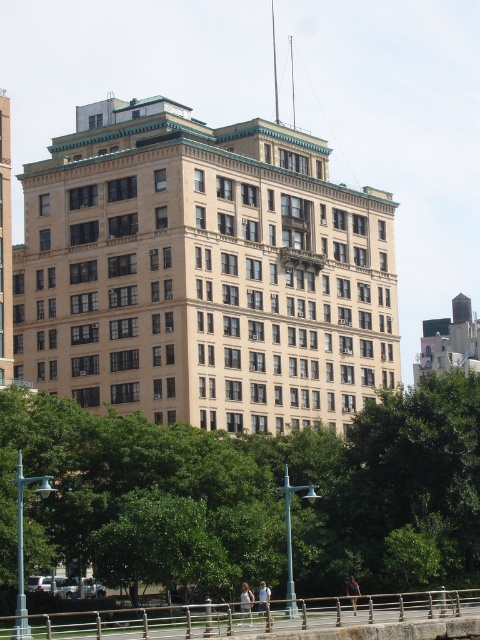
Question: Can you confirm if green leafy tree at center is positioned above light blue denim jeans at center?

Choices:
 (A) yes
 (B) no

Answer: (A)

Question: From the image, what is the correct spatial relationship of light blue denim jeans at center in relation to light brown fabric shirt at center?

Choices:
 (A) left
 (B) right

Answer: (A)

Question: Which object is the farthest from the green leafy tree at center?

Choices:
 (A) light blue denim jeans at center
 (B) light brown fabric shirt at center
 (C) white cotton shirt at lower center

Answer: (C)

Question: Can you confirm if green leafy tree at center is wider than white cotton shirt at lower center?

Choices:
 (A) no
 (B) yes

Answer: (B)

Question: Among these objects, which one is nearest to the camera?

Choices:
 (A) green leafy tree at center
 (B) light blue denim jeans at center
 (C) light brown fabric shirt at center
 (D) white cotton shirt at lower center

Answer: (B)

Question: Which of the following is the farthest from the observer?

Choices:
 (A) (147, 442)
 (B) (356, 588)

Answer: (A)